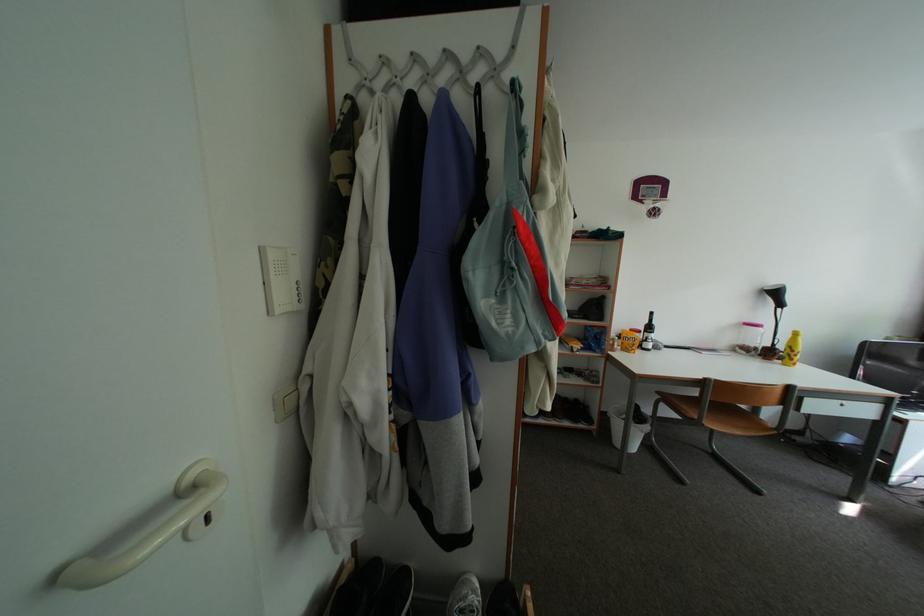
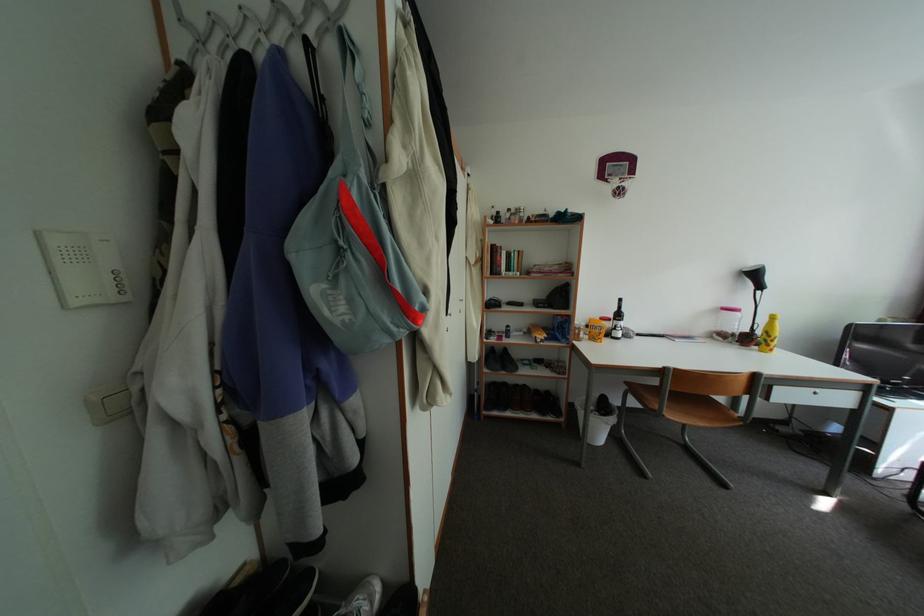
Question: Which direction would the cameraman need to move to produce the second image? Reply with the corresponding letter.

Choices:
 (A) Left
 (B) Right
 (C) Forward
 (D) Backward

Answer: (B)